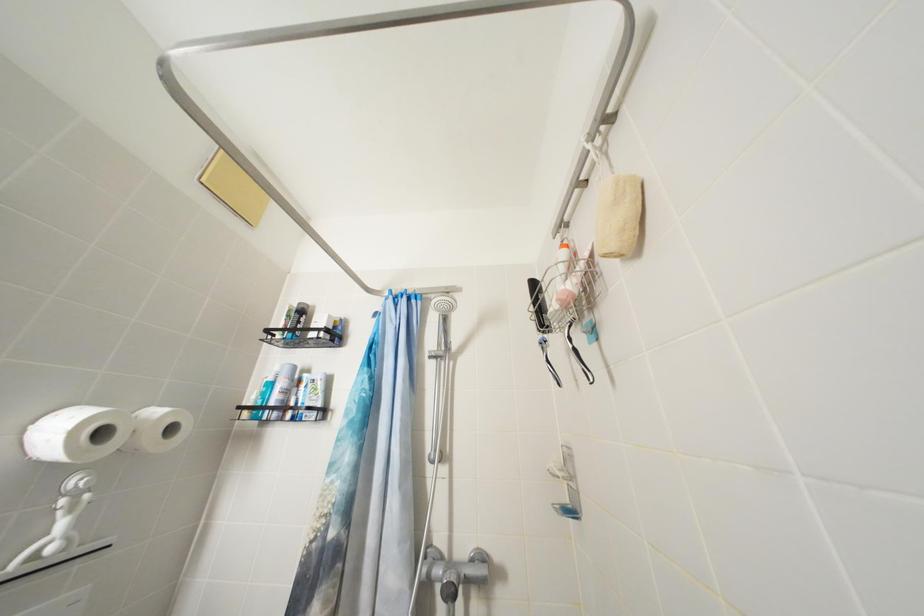
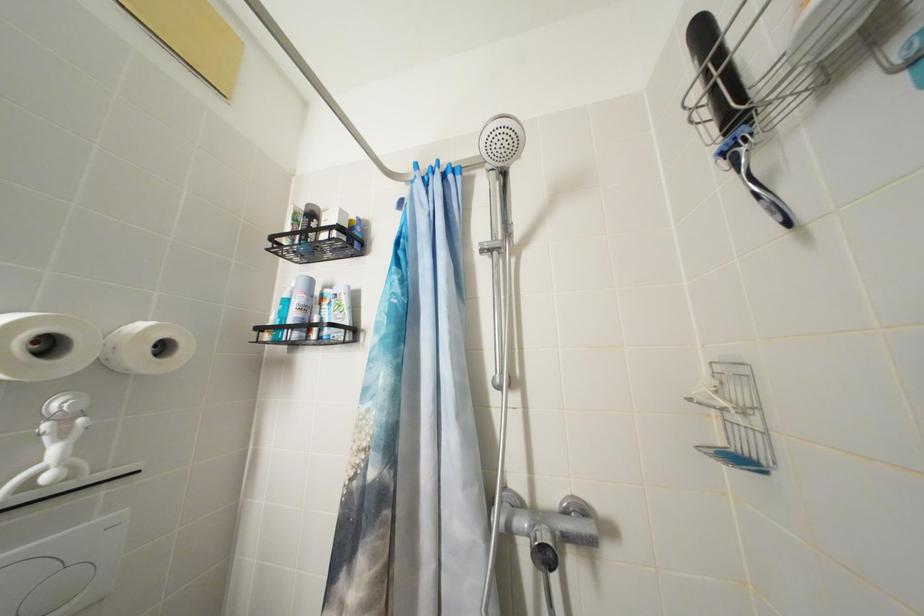
Question: The first image is from the beginning of the video and the second image is from the end. How did the camera likely rotate when shooting the video?

Choices:
 (A) Left
 (B) Right
 (C) Up
 (D) Down

Answer: (D)